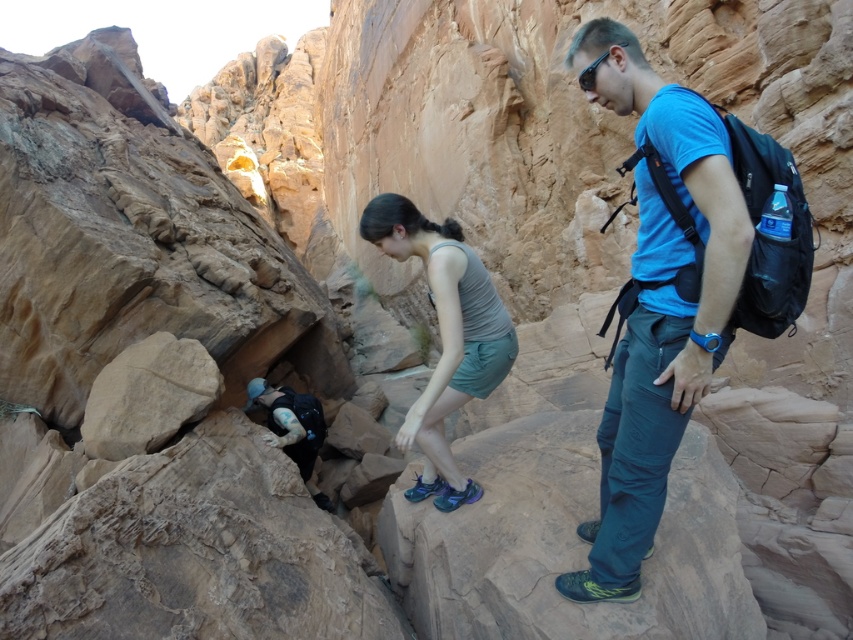
Question: Which point appears closest to the camera in this image?

Choices:
 (A) (660, 106)
 (B) (688, 333)

Answer: (A)

Question: Which point is closer to the camera?

Choices:
 (A) black plastic sunglasses at upper right
 (B) gray fabric tank top at center

Answer: (A)

Question: Observing the image, what is the correct spatial positioning of blue fabric shirt at center in reference to black plastic sunglasses at upper right?

Choices:
 (A) left
 (B) right

Answer: (B)

Question: Which object appears farthest from the camera in this image?

Choices:
 (A) black plastic sunglasses at upper right
 (B) blue fabric shirt at upper right
 (C) gray fabric tank top at center
 (D) blue fabric shirt at center

Answer: (C)

Question: Is blue fabric shirt at upper right further to the viewer compared to blue fabric shirt at center?

Choices:
 (A) yes
 (B) no

Answer: (A)

Question: Does blue fabric shirt at upper right appear over black plastic sunglasses at upper right?

Choices:
 (A) no
 (B) yes

Answer: (A)